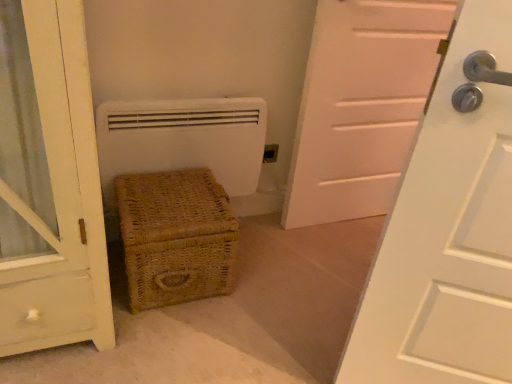
Question: Based on their positions, is matte plastic electrical outlet at center located to the left or right of white matte heater at center?

Choices:
 (A) right
 (B) left

Answer: (A)

Question: Is matte plastic electrical outlet at center spatially inside white matte heater at center, or outside of it?

Choices:
 (A) inside
 (B) outside

Answer: (B)

Question: Which is farther from the white matte heater at center?

Choices:
 (A) matte plastic electrical outlet at center
 (B) woven brown basket at lower left
 (C) white matte door at center

Answer: (C)

Question: Which object is positioned closest to the white matte heater at center?

Choices:
 (A) white matte door at center
 (B) matte plastic electrical outlet at center
 (C) woven brown basket at lower left

Answer: (C)